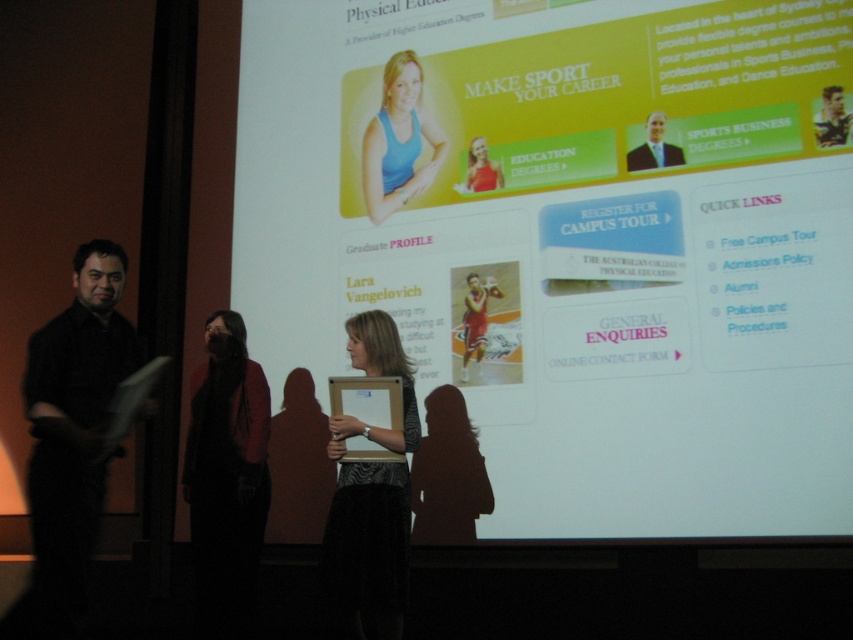
Question: Based on their relative distances, which object is nearer to the matte red tank top at upper center?

Choices:
 (A) light blue shirt at upper right
 (B) metallic silver helmet at upper right

Answer: (A)

Question: Is black matte shirt at left above light blue shirt at upper right?

Choices:
 (A) no
 (B) yes

Answer: (A)

Question: Does blue fabric tank top at upper center have a larger size compared to metallic silver helmet at upper right?

Choices:
 (A) yes
 (B) no

Answer: (A)

Question: Can you confirm if black matte shirt at left is bigger than metallic silver helmet at upper right?

Choices:
 (A) yes
 (B) no

Answer: (A)

Question: Which point is farther to the camera?

Choices:
 (A) matte red tank top at upper center
 (B) light blue shirt at upper right

Answer: (A)

Question: Which object appears closest to the camera in this image?

Choices:
 (A) velvet black dress at center
 (B) blue fabric tank top at upper center
 (C) matte red tank top at upper center

Answer: (A)